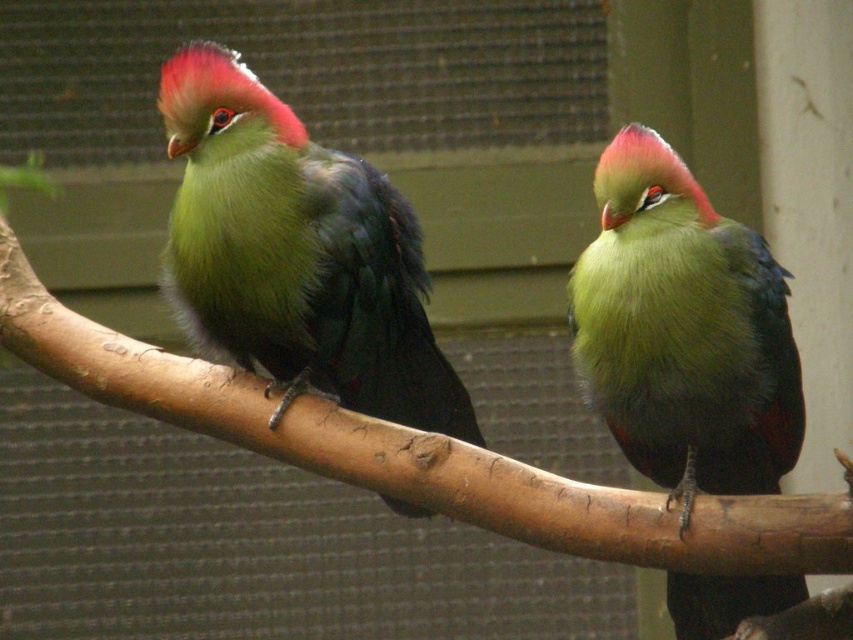
Question: Which point is closer to the camera?

Choices:
 (A) brown rough tree branch at center
 (B) lime green feathers at center
 (C) green matte parrot at center

Answer: (A)

Question: Can you confirm if green matte parrot at center is wider than brown rough tree branch at center?

Choices:
 (A) no
 (B) yes

Answer: (A)

Question: Among these points, which one is farthest from the camera?

Choices:
 (A) (228, 436)
 (B) (198, 196)

Answer: (A)

Question: Does green matte parrot at center have a lesser width compared to brown rough tree branch at center?

Choices:
 (A) no
 (B) yes

Answer: (B)

Question: Considering the real-world distances, which object is closest to the brown rough tree branch at center?

Choices:
 (A) green matte parrot at center
 (B) lime green feathers at center

Answer: (B)

Question: Is green matte parrot at center bigger than brown rough tree branch at center?

Choices:
 (A) no
 (B) yes

Answer: (A)